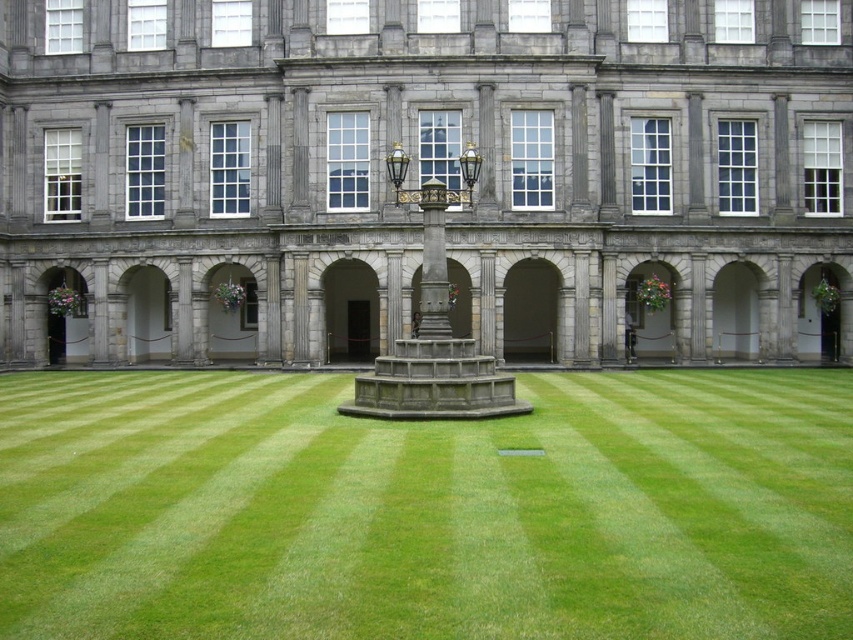
Between gray stone building at center and green grass at center, which one is positioned lower?

green grass at center is below.

Does gray stone building at center come in front of green grass at center?

No, it is not.

Between point (71, 164) and point (306, 419), which one is positioned behind?

The point (71, 164) is behind.

At what (x,y) coordinates should I click in order to perform the action: click on gray stone building at center. Please return your answer as a coordinate pair (x, y). This screenshot has width=853, height=640. Looking at the image, I should click on (424, 177).